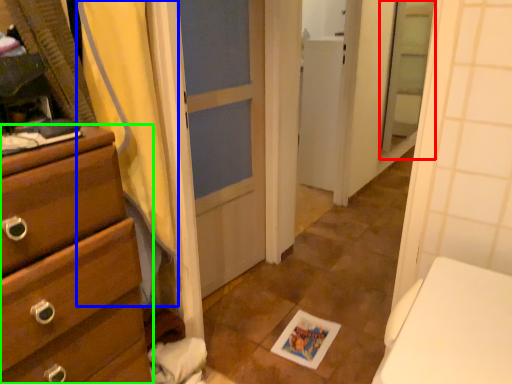
Question: Based on their relative distances, which object is farther from screen door (highlighted by a red box)? Choose from shower curtain (highlighted by a blue box) and chest of drawers (highlighted by a green box).

Choices:
 (A) shower curtain
 (B) chest of drawers

Answer: (B)